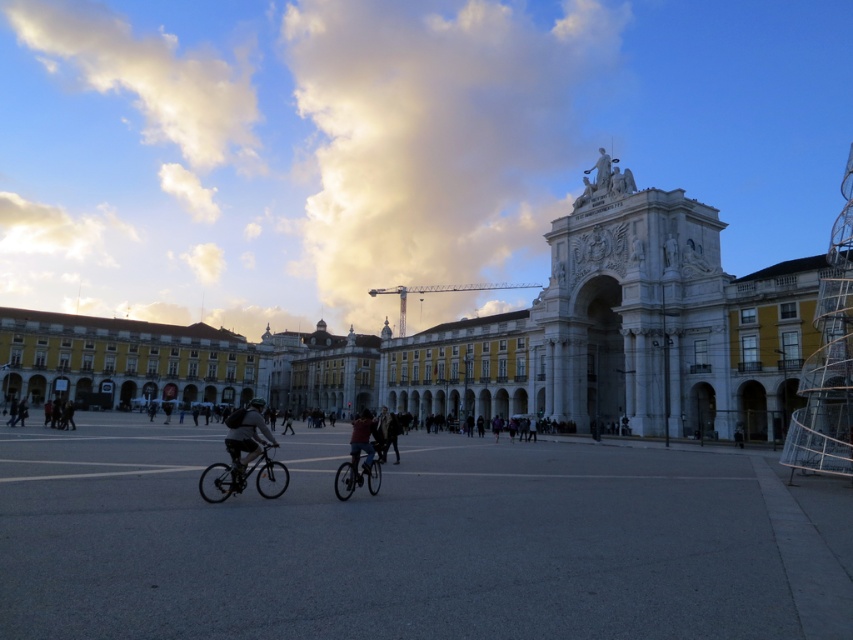
Question: Can you confirm if concrete pavement at center is thinner than dark blue jeans at center?

Choices:
 (A) no
 (B) yes

Answer: (A)

Question: Which is farther from the shiny metallic bicycle at lower left?

Choices:
 (A) dark blue jeans at center
 (B) dark gray fabric jacket at center
 (C) shiny metallic bicycle at center
 (D) concrete pavement at center

Answer: (D)

Question: Estimate the real-world distances between objects in this image. Which object is farther from the concrete pavement at center?

Choices:
 (A) dark gray jacket at center
 (B) dark blue jeans at center
 (C) dark gray fabric jacket at center
 (D) dark gray jacket at lower left

Answer: (D)

Question: Which object appears closest to the camera in this image?

Choices:
 (A) shiny metallic bicycle at center
 (B) concrete pavement at center
 (C) dark gray jacket at lower left
 (D) dark gray fabric jacket at center

Answer: (B)

Question: Is concrete pavement at center behind dark blue jeans at center?

Choices:
 (A) no
 (B) yes

Answer: (A)

Question: Does concrete pavement at center have a larger size compared to dark blue jeans at center?

Choices:
 (A) yes
 (B) no

Answer: (B)